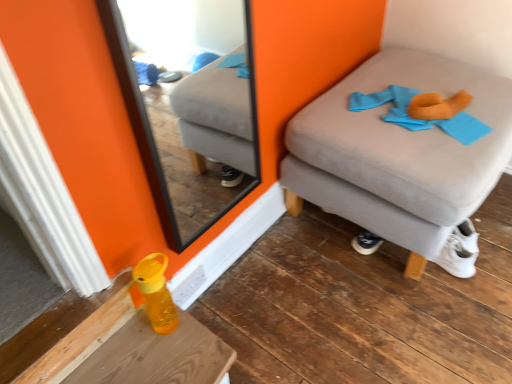
In order to click on free point in front of suede ottoman at right in this screenshot , I will do `click(401, 321)`.